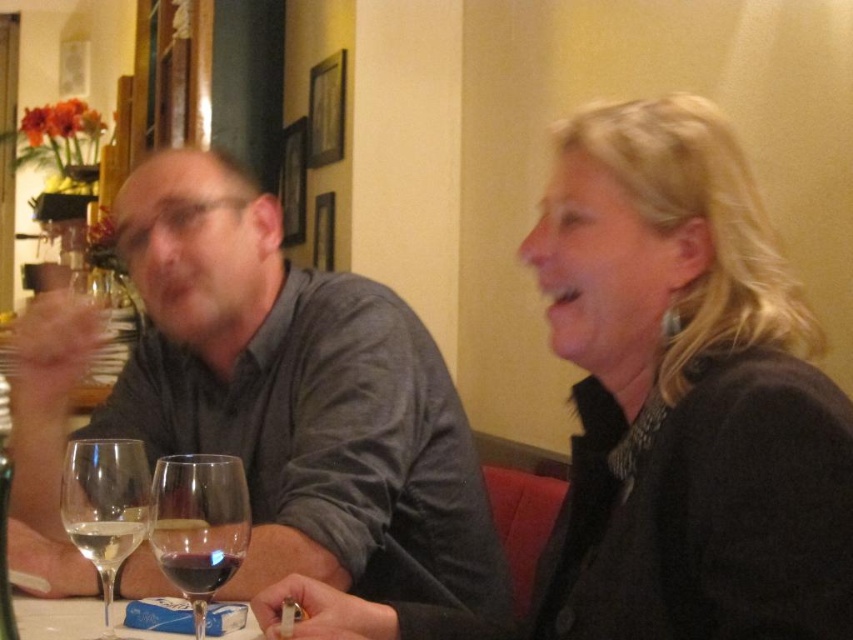
Question: In this image, where is matte black jacket at center located relative to clear glass wine glass at lower left?

Choices:
 (A) right
 (B) left

Answer: (A)

Question: Which point is closer to the camera?

Choices:
 (A) dark red glass at lower left
 (B) transparent glass at center

Answer: (B)

Question: In this image, where is gray matte shirt at left located relative to transparent glass at center?

Choices:
 (A) above
 (B) below

Answer: (A)

Question: Which point appears farthest from the camera in this image?

Choices:
 (A) (165, 464)
 (B) (612, 339)
 (C) (137, 444)
 (D) (132, 522)

Answer: (C)

Question: Does transparent glass at center appear under dark red glass at lower left?

Choices:
 (A) no
 (B) yes

Answer: (B)

Question: Which point is closer to the camera taking this photo?

Choices:
 (A) (183, 516)
 (B) (107, 621)
 (C) (74, 376)
 (D) (672, 417)

Answer: (A)